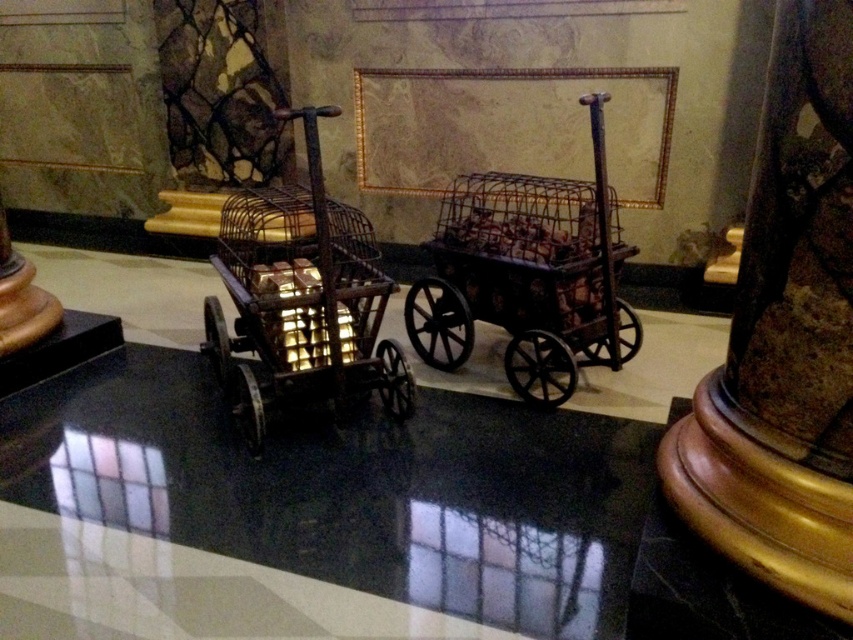
Which of these two, rusty metal trolley at center or rusty metal cart at center, stands taller?

With more height is rusty metal trolley at center.

Which is in front, point (363, 340) or point (561, 337)?

Point (363, 340) is in front.

Is point (347, 240) in front of point (456, 332)?

Yes, it is in front of point (456, 332).

The width and height of the screenshot is (853, 640). What are the coordinates of `rusty metal trolley at center` in the screenshot? It's located at (302, 304).